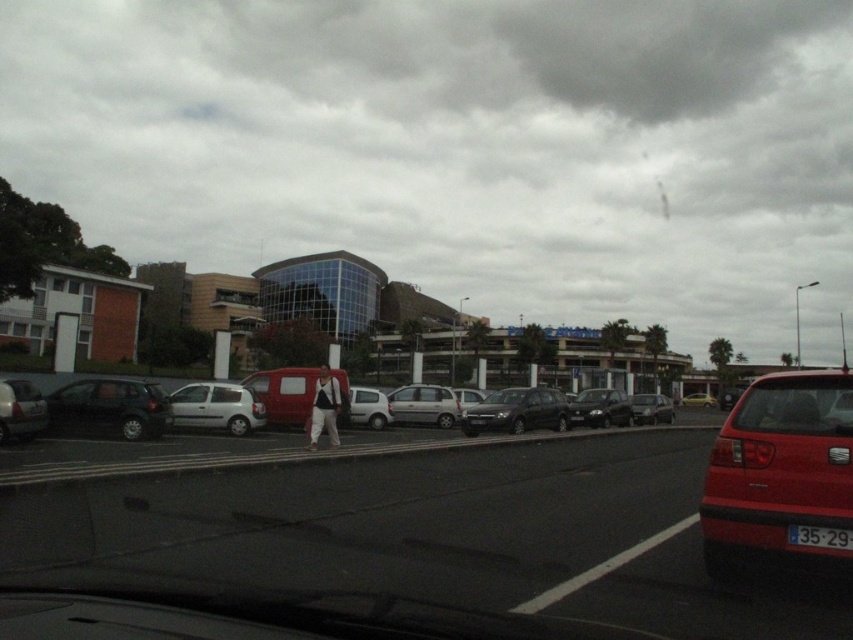
You are sitting in a car parked in the parking lot and want to exit. You see a shiny black sedan at center at point (601,408). Is there any vehicle blocking your path to the exit? Please consider the parking lot layout described in the scene.

The shiny black sedan at center at point (601,408) is located at the center of the parking lot. Since the parking lot has vehicles parked in neat rows, it is possible that other vehicles in the same row or adjacent rows might be blocking the path to the exit depending on your current parking position.

You are driving in a parking lot and see a matte black suv at left and a matte black car at center. Which one is more to the left?

The matte black suv at left is more to the left because it is positioned on the left side of the matte black car at center.

You are sitting in a car parked in the parking lot and want to check if the point at coordinate point (459,486) is closer to you than the point at point (347,413). Based on the scene, can you confirm this?

Yes, according to the scene description, point (459,486) is closer to the viewer than point (347,413).